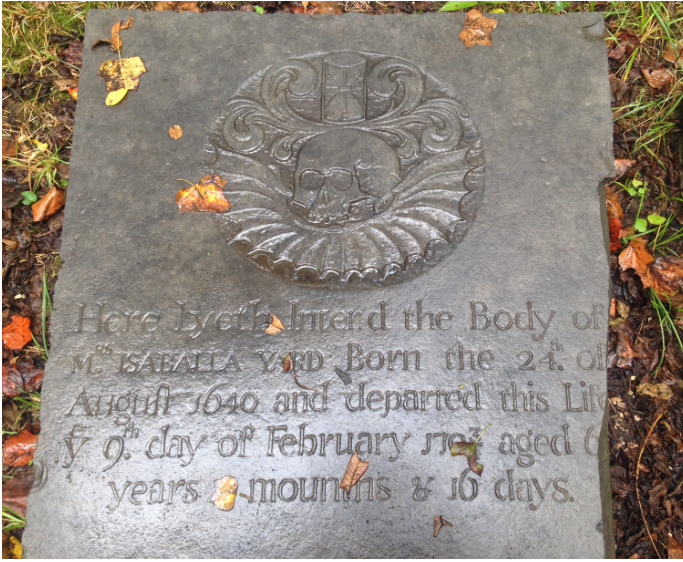
The height and width of the screenshot is (562, 683). What are the coordinates of `hourglass` in the screenshot? It's located at (348, 106).